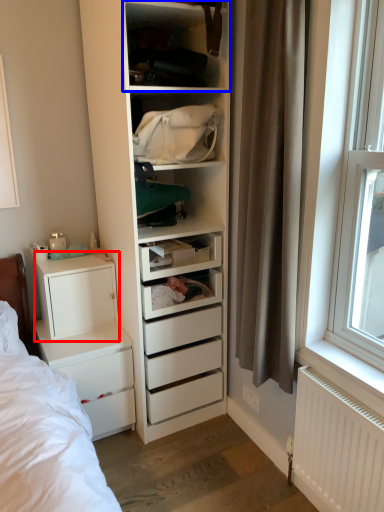
Question: Which point is further to the camera, cabinetry (highlighted by a red box) or shelf (highlighted by a blue box)?

Choices:
 (A) cabinetry
 (B) shelf

Answer: (A)